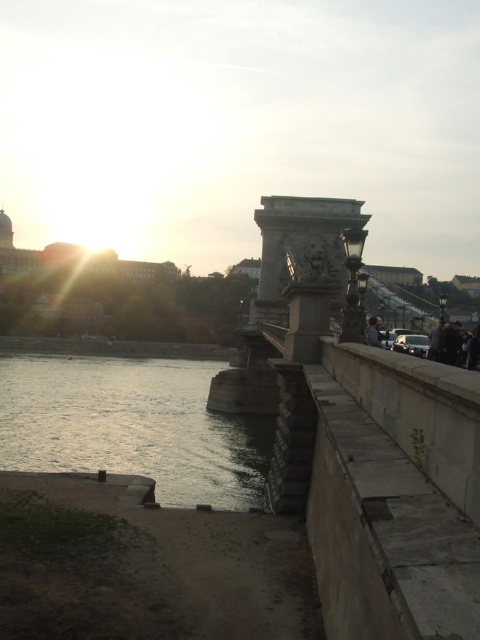
Is silvery reflective water at lower left bigger than dark gray fabric jacket at right?

Indeed, silvery reflective water at lower left has a larger size compared to dark gray fabric jacket at right.

Based on the photo, how distant is silvery reflective water at lower left from dark gray fabric jacket at right?

silvery reflective water at lower left is 50.83 meters from dark gray fabric jacket at right.

Is point (106, 387) farther from camera compared to point (367, 340)?

That is True.

Find the location of a particular element. silvery reflective water at lower left is located at coordinates (132, 426).